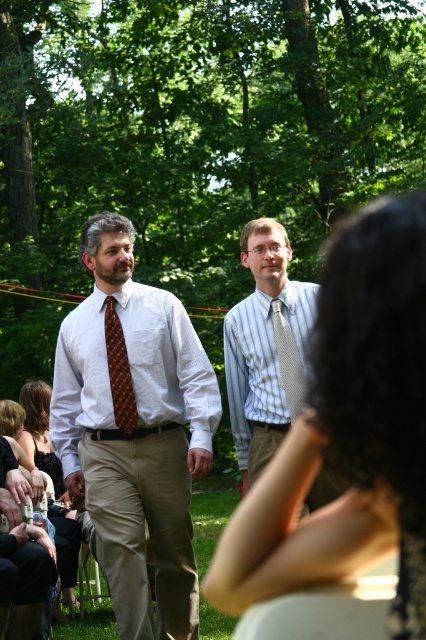
You are a photographer taking a picture of the two men in the scene. You want to focus on the brown woven tie at center. Where exactly should you aim your camera to capture it?

You should aim your camera at point (118, 371) to capture the brown woven tie at center.

What is located at the coordinates point (167, 362)?

The white woven shirt at left is located at point (167, 362).

You are a photographer adjusting your camera settings to focus on the subjects in the scene. Since both the matte brown tie at center and the striped cotton shirt at center are in your frame, which one should you adjust your focus to prioritize if you want the closer object to be sharp?

The matte brown tie at center is closer to the viewer than the striped cotton shirt at center, so you should prioritize focusing on the matte brown tie at center to ensure it is sharp.